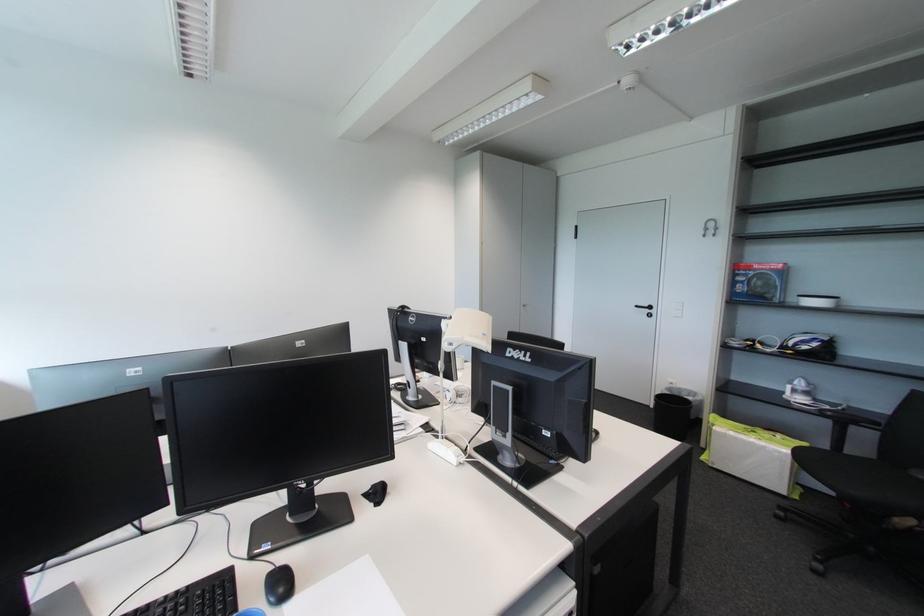
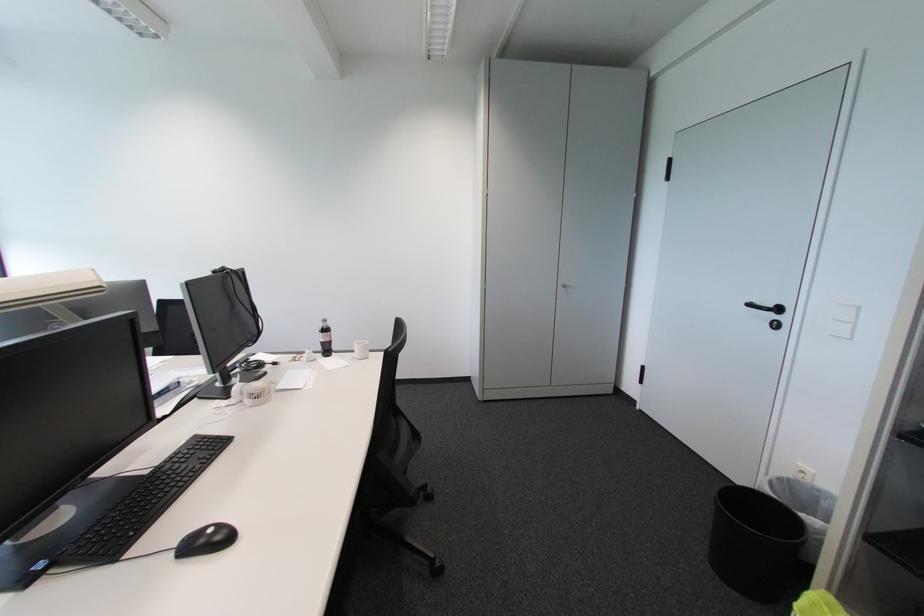
Where in the second image is the point corresponding to the point at 653,312 from the first image?

(777, 317)